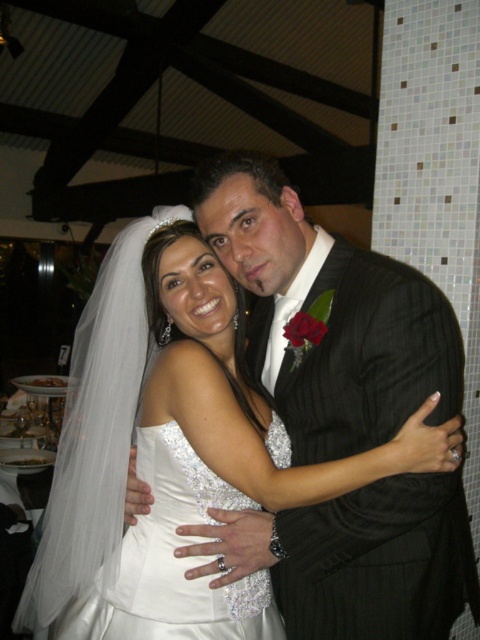
Question: Can you confirm if matte black suit at center is thinner than white satin dress at center?

Choices:
 (A) yes
 (B) no

Answer: (B)

Question: Which point is farther to the camera?

Choices:
 (A) (384, 540)
 (B) (123, 604)

Answer: (B)

Question: Which point is farther to the camera?

Choices:
 (A) (211, 477)
 (B) (410, 506)

Answer: (A)

Question: Can you confirm if matte black suit at center is positioned below white satin dress at center?

Choices:
 (A) yes
 (B) no

Answer: (B)

Question: Is matte black suit at center further to the viewer compared to white satin dress at center?

Choices:
 (A) no
 (B) yes

Answer: (A)